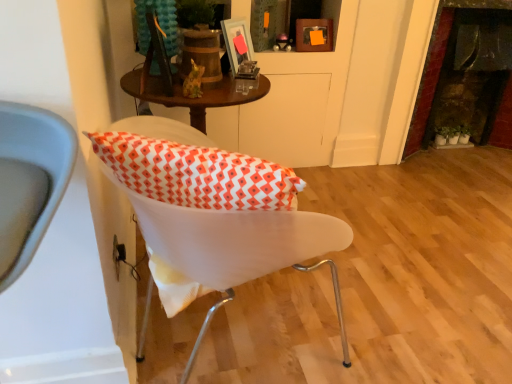
Question: Is white plastic chair at center positioned with its back to green matte plant at right?

Choices:
 (A) yes
 (B) no

Answer: (B)

Question: From a real-world perspective, is white plastic chair at center positioned under green matte plant at right based on gravity?

Choices:
 (A) no
 (B) yes

Answer: (A)

Question: Are white plastic chair at center and green matte plant at right beside each other?

Choices:
 (A) yes
 (B) no

Answer: (B)

Question: Is the depth of white plastic chair at center greater than that of green matte plant at right?

Choices:
 (A) no
 (B) yes

Answer: (A)

Question: Is white plastic chair at center to the right of green matte plant at right from the viewer's perspective?

Choices:
 (A) no
 (B) yes

Answer: (A)

Question: Does white plastic chair at center have a larger size compared to green matte plant at right?

Choices:
 (A) yes
 (B) no

Answer: (A)

Question: From a real-world perspective, is metallic silver picture frame at upper center, which is the first picture frame in front-to-back order, over dark stone fireplace at right?

Choices:
 (A) no
 (B) yes

Answer: (B)

Question: Is metallic silver picture frame at upper center, which is the third picture frame in back-to-front order, oriented away from dark stone fireplace at right?

Choices:
 (A) yes
 (B) no

Answer: (B)

Question: Considering the relative sizes of metallic silver picture frame at upper center, which is the third picture frame in back-to-front order, and dark stone fireplace at right in the image provided, is metallic silver picture frame at upper center, which is the third picture frame in back-to-front order, taller than dark stone fireplace at right?

Choices:
 (A) yes
 (B) no

Answer: (B)

Question: From a real-world perspective, is metallic silver picture frame at upper center, which is the first picture frame in front-to-back order, positioned under dark stone fireplace at right based on gravity?

Choices:
 (A) no
 (B) yes

Answer: (A)

Question: Is dark stone fireplace at right located within metallic silver picture frame at upper center, which is the first picture frame in front-to-back order?

Choices:
 (A) no
 (B) yes

Answer: (A)

Question: Is metallic silver picture frame at upper center, which is the 1th picture frame in left-to-right order, not inside dark stone fireplace at right?

Choices:
 (A) yes
 (B) no

Answer: (A)

Question: From the image's perspective, would you say matte glass picture frame at upper center, which is the second picture frame in back-to-front order, is positioned over metallic silver picture frame at upper center, which is the first picture frame in front-to-back order?

Choices:
 (A) no
 (B) yes

Answer: (B)